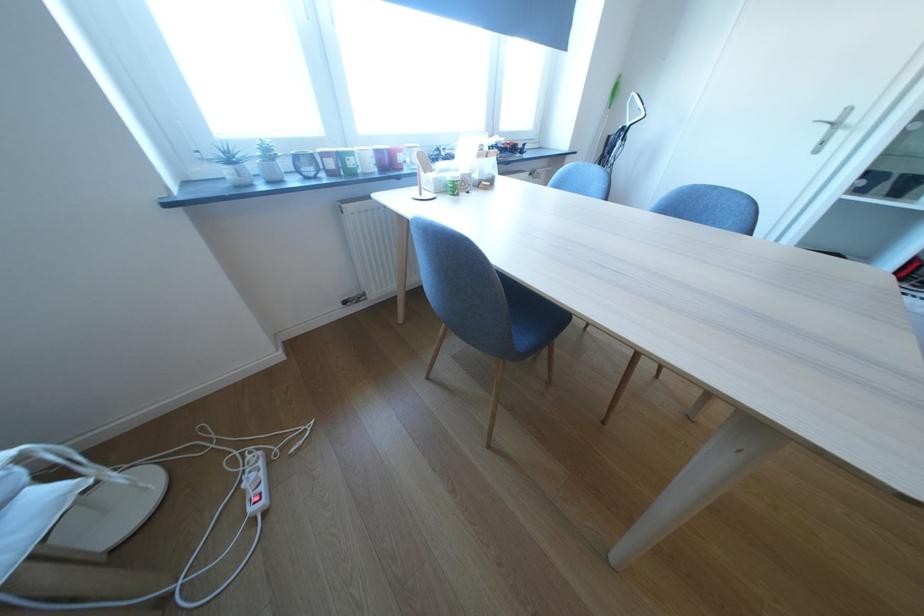
Find where to lift the dark glass jar. Please return your answer as a coordinate pair (x, y).

(305, 164)